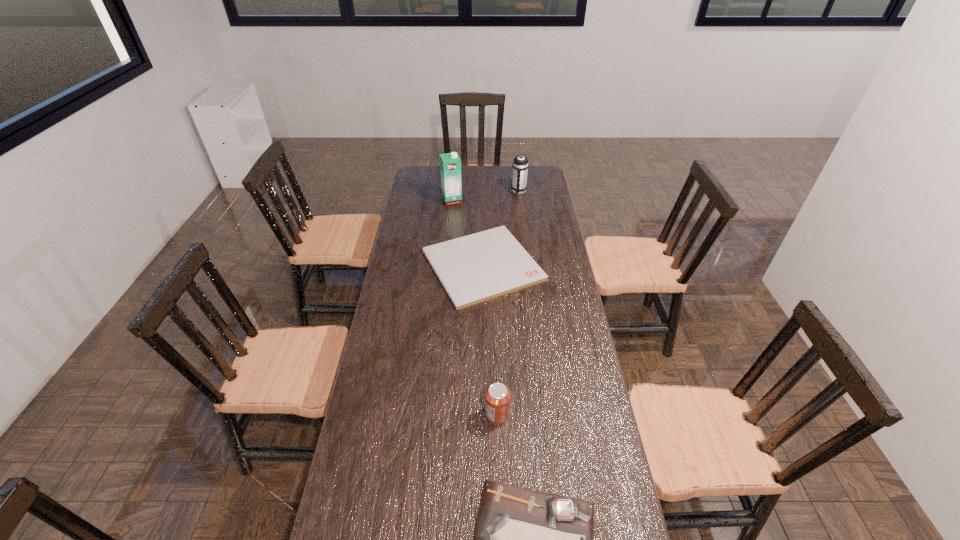
At what (x,y) coordinates should I click in order to perform the action: click on carton. Please return your answer as a coordinate pair (x, y). Looking at the image, I should click on (450, 164).

Locate an element on the screen. The image size is (960, 540). the fourth shortest object is located at coordinates (520, 165).

Find the location of `the fourth farthest object`. the fourth farthest object is located at coordinates (497, 395).

This screenshot has height=540, width=960. I want to click on can, so click(x=497, y=395).

In order to click on the third farthest object in this screenshot , I will do `click(475, 268)`.

Locate an element on the screen. This screenshot has height=540, width=960. free location located 0.070m on the back of the tallest object is located at coordinates (453, 188).

The height and width of the screenshot is (540, 960). In order to click on vacant area situated 0.330m on the side with the handle of the fourth shortest object in this screenshot , I will do `click(524, 236)`.

The height and width of the screenshot is (540, 960). What are the coordinates of `vacant space situated on the right of the third tallest object` in the screenshot? It's located at (542, 415).

At what (x,y) coordinates should I click in order to perform the action: click on vacant area situated on the front of the third nearest object. Please return your answer as a coordinate pair (x, y). The width and height of the screenshot is (960, 540). Looking at the image, I should click on (484, 346).

The image size is (960, 540). Find the location of `object positioned at the far edge`. object positioned at the far edge is located at coordinates (520, 165).